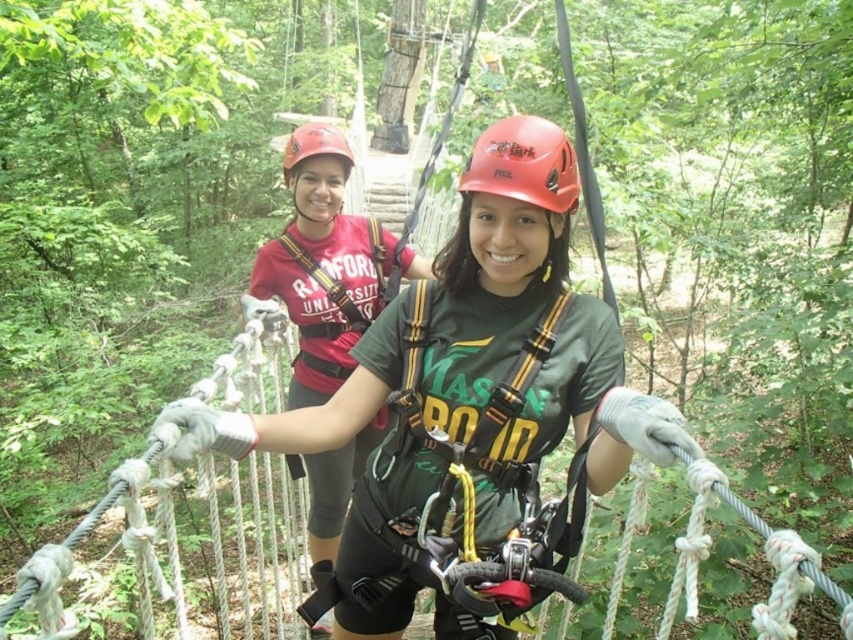
Question: Considering the relative positions of matte black helmet at upper center and matte red helmet at center in the image provided, where is matte black helmet at upper center located with respect to matte red helmet at center?

Choices:
 (A) below
 (B) above

Answer: (A)

Question: Considering the relative positions of matte red helmet at center and matte red helmet at upper center in the image provided, where is matte red helmet at center located with respect to matte red helmet at upper center?

Choices:
 (A) below
 (B) above

Answer: (A)

Question: Does matte orange helmet at center appear under matte red helmet at upper center?

Choices:
 (A) no
 (B) yes

Answer: (B)

Question: Estimate the real-world distances between objects in this image. Which object is farther from the matte orange helmet at center?

Choices:
 (A) matte red helmet at center
 (B) matte black helmet at upper center
 (C) matte red helmet at upper center

Answer: (A)

Question: Which of these objects is positioned farthest from the matte red helmet at center?

Choices:
 (A) matte orange helmet at center
 (B) matte black helmet at upper center

Answer: (A)

Question: Which of the following is the farthest from the observer?

Choices:
 (A) matte black helmet at upper center
 (B) matte orange helmet at center
 (C) matte red helmet at upper center

Answer: (C)